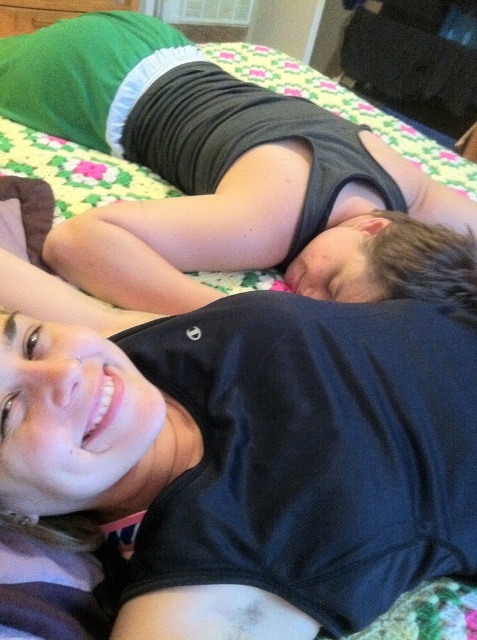
Who is positioned more to the right, black matte tank top at upper center or matte black tank top at center?

From the viewer's perspective, black matte tank top at upper center appears more on the right side.

Does black matte tank top at upper center come behind matte black tank top at center?

No, it is in front of matte black tank top at center.

Does point (349, 576) come in front of point (193, 234)?

Yes, it is in front of point (193, 234).

At what (x,y) coordinates should I click in order to perform the action: click on black matte tank top at upper center. Please return your answer as a coordinate pair (x, y). The width and height of the screenshot is (477, 640). Looking at the image, I should click on (263, 445).